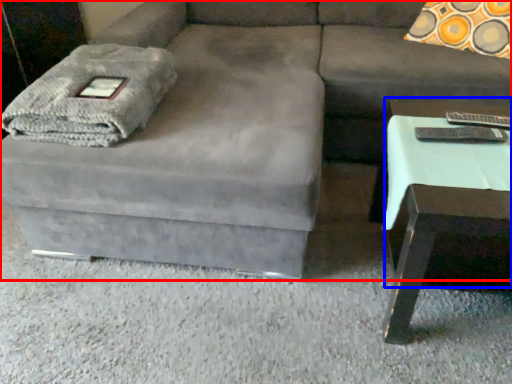
Question: Which object is further to the camera taking this photo, studio couch (highlighted by a red box) or side table (highlighted by a blue box)?

Choices:
 (A) studio couch
 (B) side table

Answer: (B)